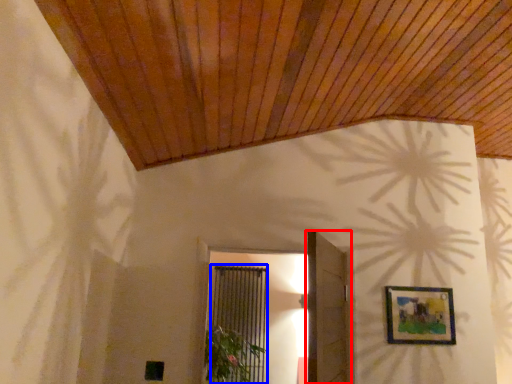
Question: Which point is further to the camera, door (highlighted by a red box) or screen door (highlighted by a blue box)?

Choices:
 (A) door
 (B) screen door

Answer: (B)